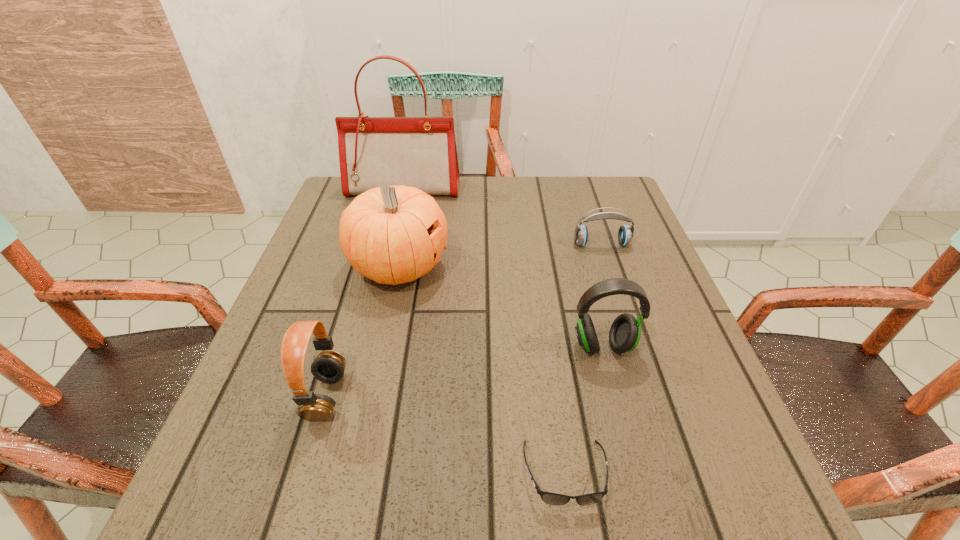
The image size is (960, 540). Find the location of `free region that satisfies the following two spatial constraints: 1. on the ear cups of the fifth tallest object; 2. on the front-facing side of the fifth shortest object`. free region that satisfies the following two spatial constraints: 1. on the ear cups of the fifth tallest object; 2. on the front-facing side of the fifth shortest object is located at coordinates (609, 266).